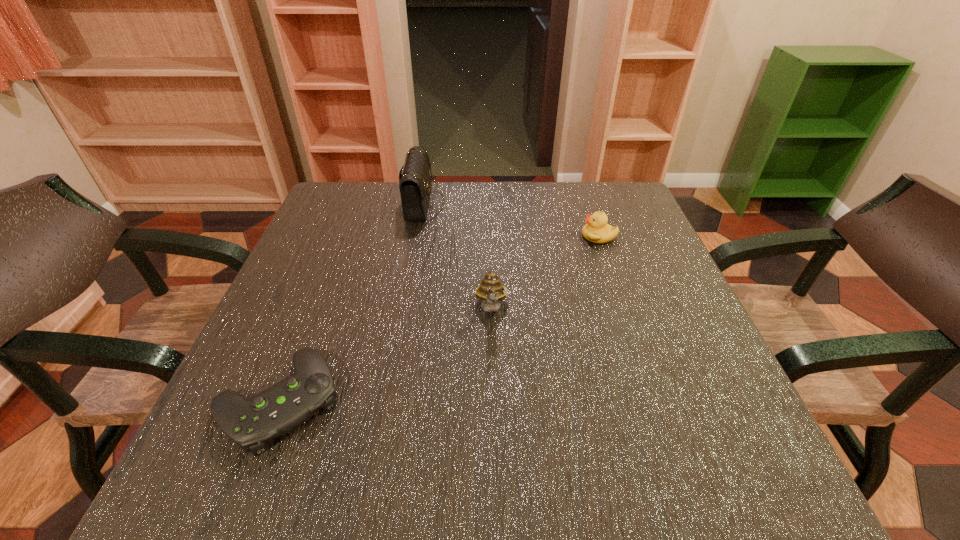
You are a GUI agent. You are given a task and a screenshot of the screen. Output one action in this format:
    pyautogui.click(x=<x>, y=<y>)
    Task: Click on the vacant region that satisfies the following two spatial constraints: 1. on the front-facing side of the rightmost object; 2. on the face of the snail
    This screenshot has width=960, height=540.
    Given the screenshot: What is the action you would take?
    pyautogui.click(x=624, y=309)

What are the coordinates of `free spot that satisfies the following two spatial constraints: 1. on the front-facing side of the rightmost object; 2. on the face of the second nearest object` in the screenshot? It's located at (624, 309).